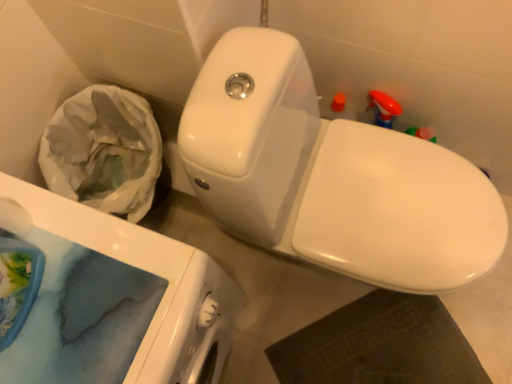
Question: Considering their positions, is white glossy porcelain at upper right located in front of or behind white glossy toilet at center?

Choices:
 (A) behind
 (B) front

Answer: (A)

Question: Looking at the image, does white glossy porcelain at upper right seem bigger or smaller compared to white glossy toilet at center?

Choices:
 (A) small
 (B) big

Answer: (B)

Question: Which object is positioned closest to the white glossy porcelain at upper right?

Choices:
 (A) white glossy toilet at center
 (B) white matte toilet paper at lower left

Answer: (B)

Question: Estimate the real-world distances between objects in this image. Which object is closer to the white glossy porcelain at upper right?

Choices:
 (A) white matte toilet paper at lower left
 (B) white glossy toilet at center

Answer: (A)